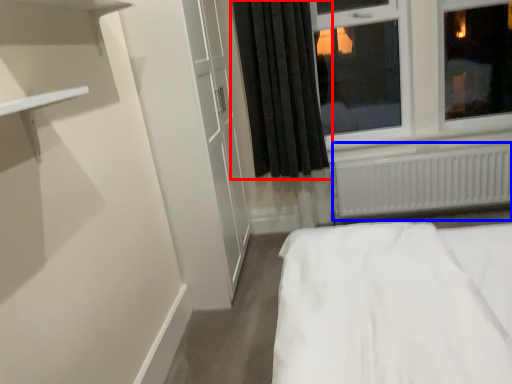
Question: Which of the following is the farthest to the observer, curtain (highlighted by a red box) or radiator (highlighted by a blue box)?

Choices:
 (A) curtain
 (B) radiator

Answer: (B)